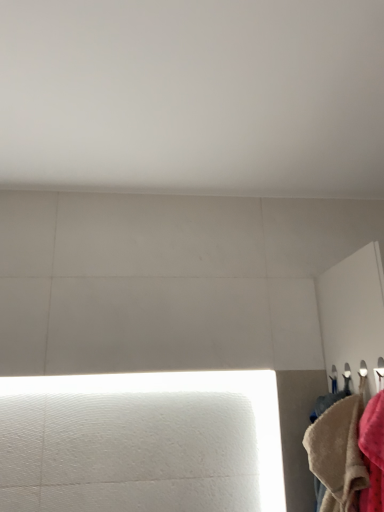
In order to face beige soft towel at right, should I rotate leftwards or rightwards?

To face it directly, rotate right by 21.752 degrees.

Describe the element at coordinates (337, 455) in the screenshot. The image size is (384, 512). I see `beige soft towel at right` at that location.

At what (x,y) coordinates should I click in order to perform the action: click on beige soft towel at right. Please return your answer as a coordinate pair (x, y). The width and height of the screenshot is (384, 512). Looking at the image, I should click on (337, 455).

The width and height of the screenshot is (384, 512). Find the location of `beige soft towel at right`. beige soft towel at right is located at coordinates (337, 455).